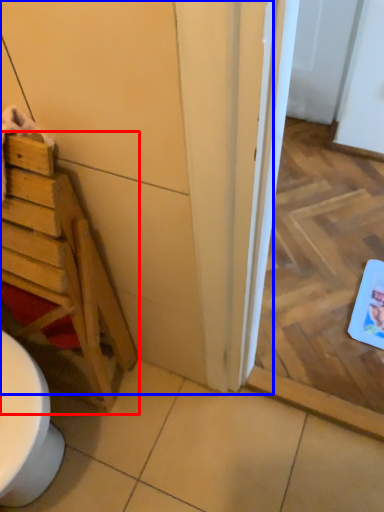
Question: Which object appears closest to the camera in this image, furniture (highlighted by a red box) or door (highlighted by a blue box)?

Choices:
 (A) furniture
 (B) door

Answer: (B)